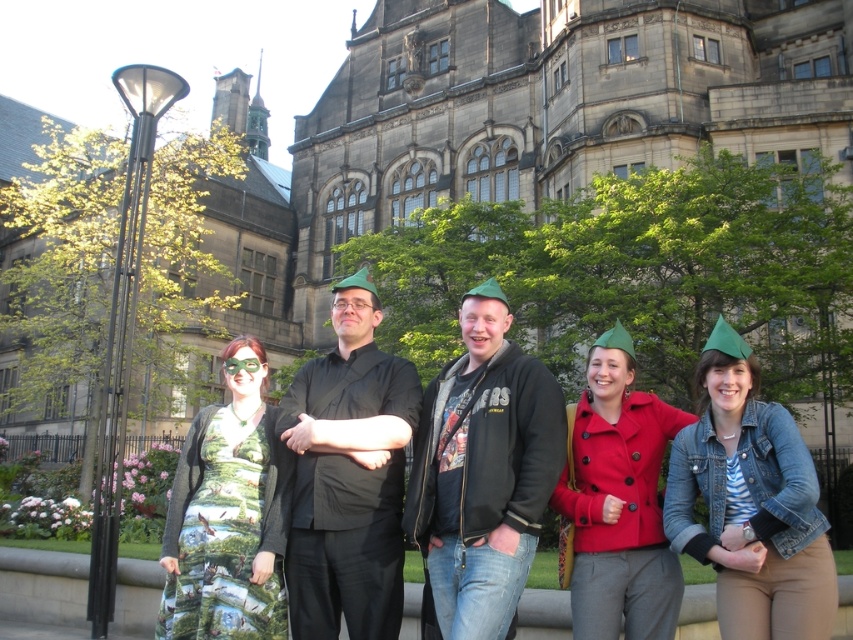
Based on the photo, you are a photographer trying to capture the group in front of the historic stone building. You notice the black matte shirt at center and the matte green hat at center. Based on their positions, which object is closer to the left side of the image?

The black matte shirt at center is to the left of the matte green hat at center, so the black matte shirt at center is closer to the left side of the image.

You are organizing a costume party and need to decide which outfit takes more space. Based on the image, which one is larger between the denim jacket at lower right and the printed fabric dress at center?

The denim jacket at lower right is bigger than the printed fabric dress at center, so the denim jacket at lower right takes more space.